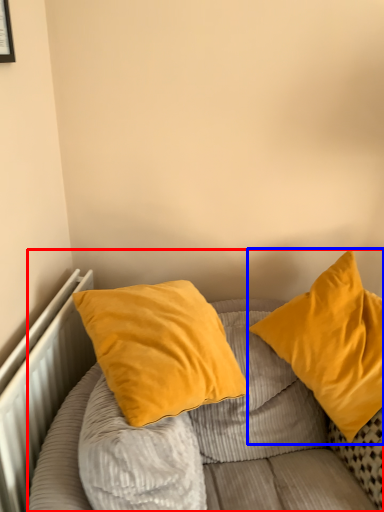
Question: Among these objects, which one is nearest to the camera, bed (highlighted by a red box) or pillow (highlighted by a blue box)?

Choices:
 (A) bed
 (B) pillow

Answer: (A)